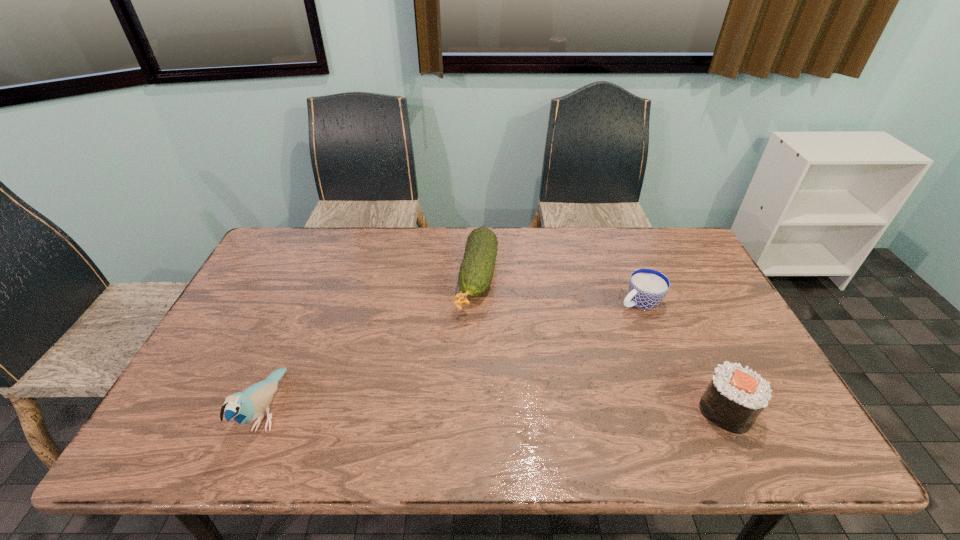
Find the location of a particular element. Image resolution: width=960 pixels, height=540 pixels. free space at the far left corner of the desktop is located at coordinates (293, 227).

In the image, there is a desktop. Where is `free region at the far right corner`? The image size is (960, 540). free region at the far right corner is located at coordinates (673, 231).

This screenshot has height=540, width=960. Identify the location of empty space that is in between the bird and the third object from right to left. (373, 345).

Locate an element on the screen. The height and width of the screenshot is (540, 960). vacant point located between the cucumber and the shortest object is located at coordinates (559, 290).

Where is `vacant area between the sushi and the second object from left to right`? The image size is (960, 540). vacant area between the sushi and the second object from left to right is located at coordinates (602, 344).

The height and width of the screenshot is (540, 960). Identify the location of free space between the sushi and the shortest object. (683, 356).

Locate an element on the screen. vacant space in between the second object from left to right and the shortest object is located at coordinates (559, 290).

I want to click on vacant space that is in between the third object from right to left and the shortest object, so click(x=559, y=290).

At what (x,y) coordinates should I click in order to perform the action: click on free space between the leftmost object and the cup. Please return your answer as a coordinate pair (x, y). The image size is (960, 540). Looking at the image, I should click on (454, 357).

This screenshot has height=540, width=960. What are the coordinates of `empty location between the sushi and the second object from left to right` in the screenshot? It's located at [x=602, y=344].